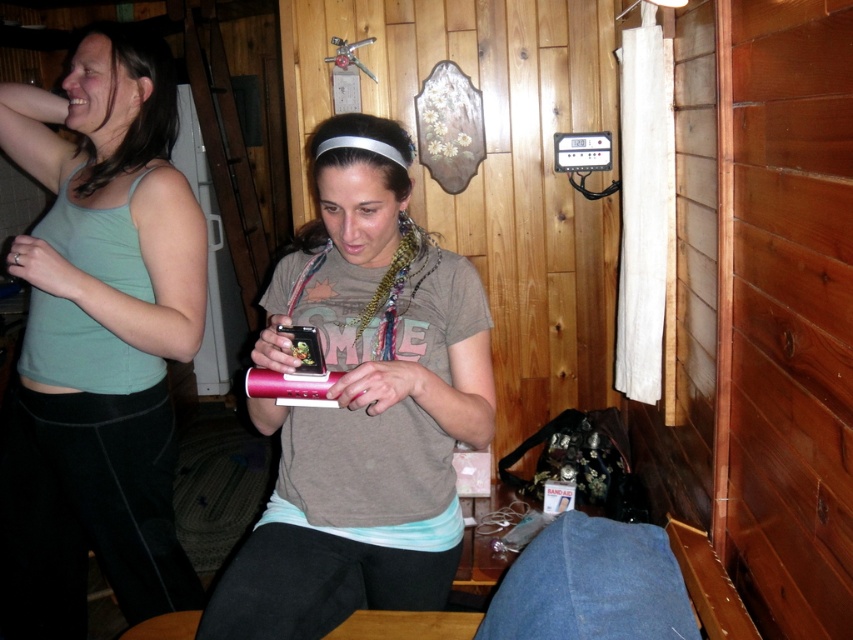
You are organizing a small event in this cabin and need to place a decorative item on the wooden bench. The item you have is the same size as the pink plastic phone at center. Can you fit it next to the matte green tank top at left without overcrowding the space?

The matte green tank top at left is bigger than the pink plastic phone at center. Since the decorative item is the same size as the pink plastic phone, it should fit next to the matte green tank top at left without overcrowding the space.

From the picture: You are standing in the cabin and want to hand a gift to the person wearing the matte green tank top at left. Based on their position in the scene, can you estimate whether you should approach from the right side or the left side to reach them?

The matte green tank top at left is located at point (97, 340), so you should approach from the right side to reach them.